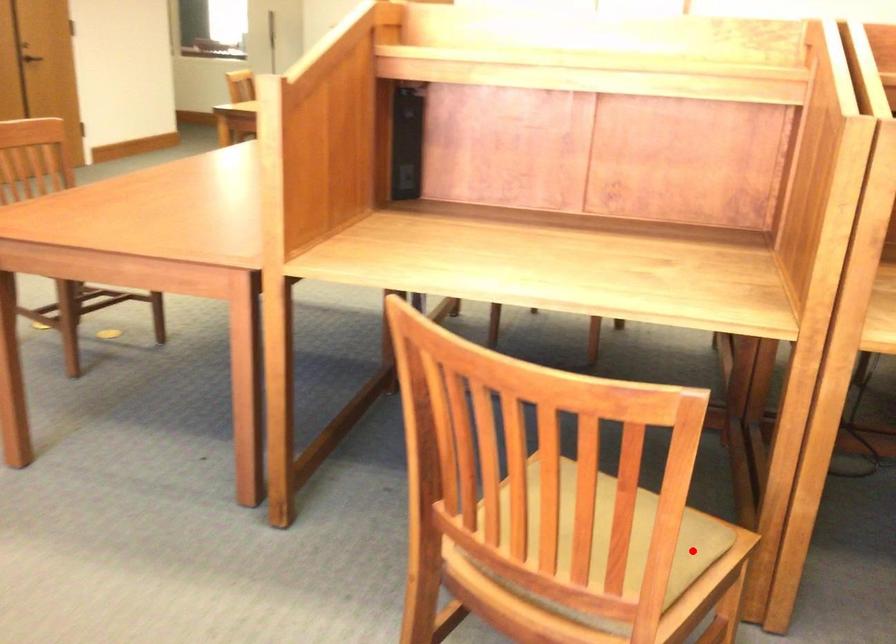
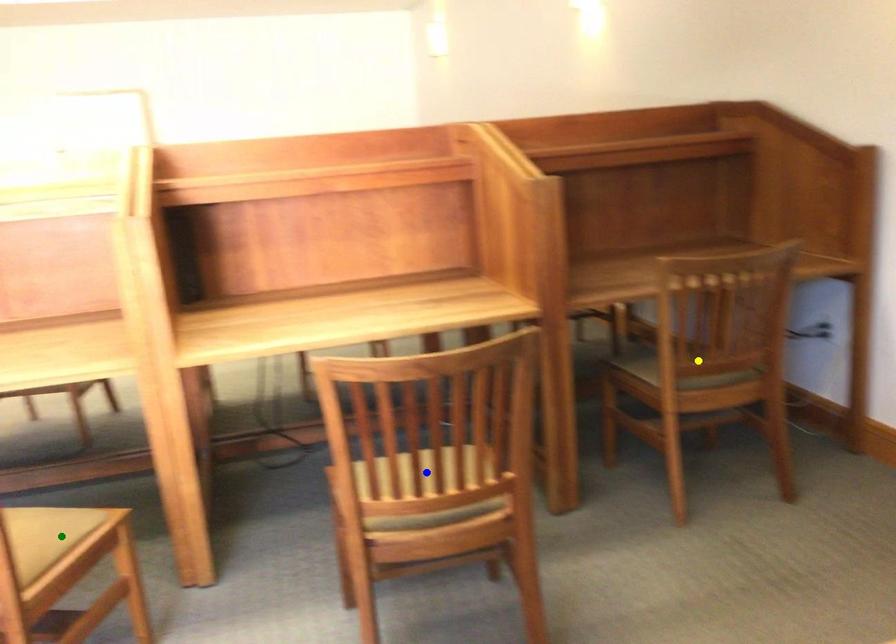
Question: I am providing you with two images of the same scene from different viewpoints. A red point is marked on the first image. You are given multiple points on the second image. Which spot in image 2 lines up with the point in image 1?

Choices:
 (A) green point
 (B) yellow point
 (C) blue point

Answer: (A)